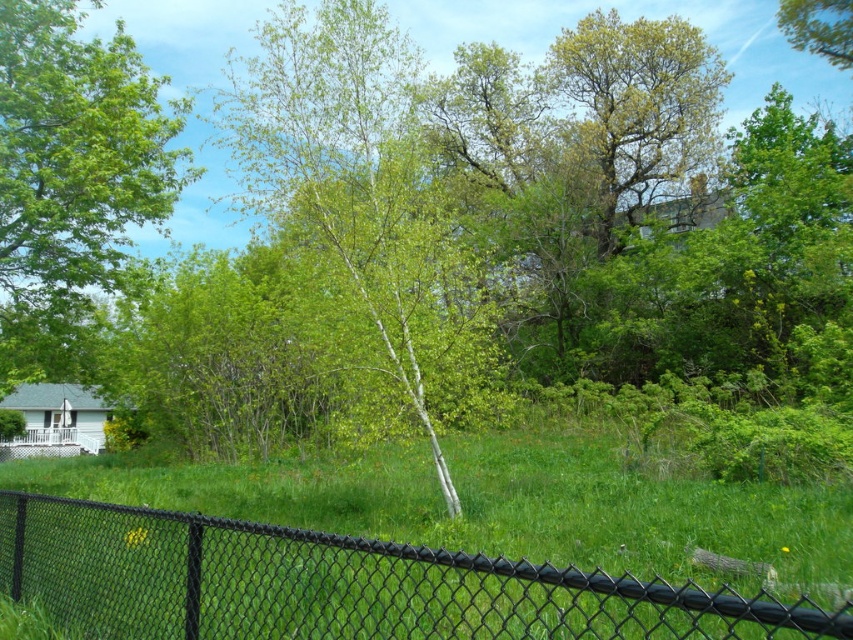
Question: Which of the following is the farthest from the observer?

Choices:
 (A) white smooth tree at center
 (B) green leafy tree at left

Answer: (B)

Question: In this image, where is black chain-link fence at lower left located relative to white smooth tree at center?

Choices:
 (A) above
 (B) below

Answer: (B)

Question: Based on their relative distances, which object is farther from the green leafy tree at left?

Choices:
 (A) black chain-link fence at lower left
 (B) white smooth tree at center

Answer: (A)

Question: Among these objects, which one is farthest from the camera?

Choices:
 (A) white smooth tree at center
 (B) black chain-link fence at lower left
 (C) green leafy tree at left

Answer: (C)

Question: Is white smooth tree at center bigger than green leafy tree at left?

Choices:
 (A) yes
 (B) no

Answer: (B)

Question: Is black chain-link fence at lower left wider than green leafy tree at left?

Choices:
 (A) no
 (B) yes

Answer: (A)